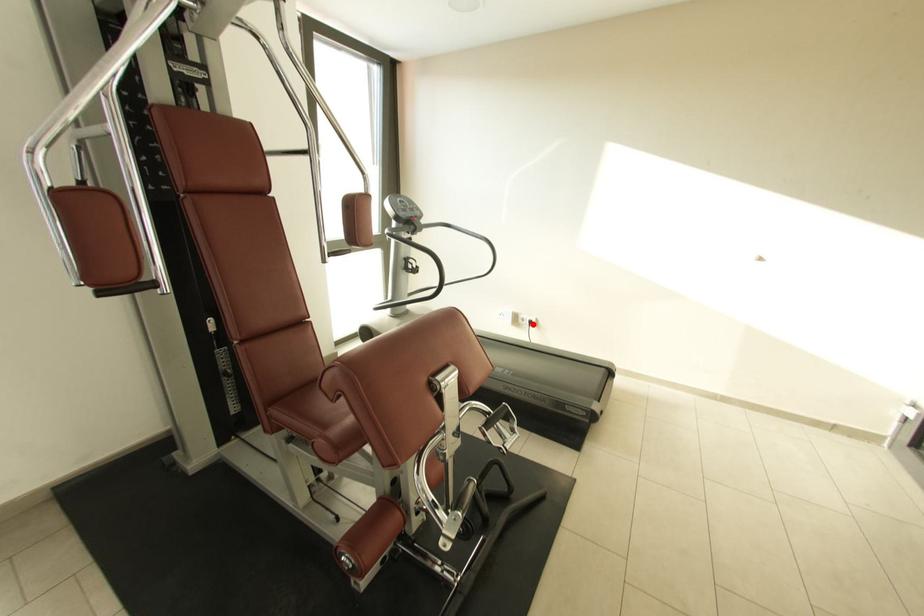
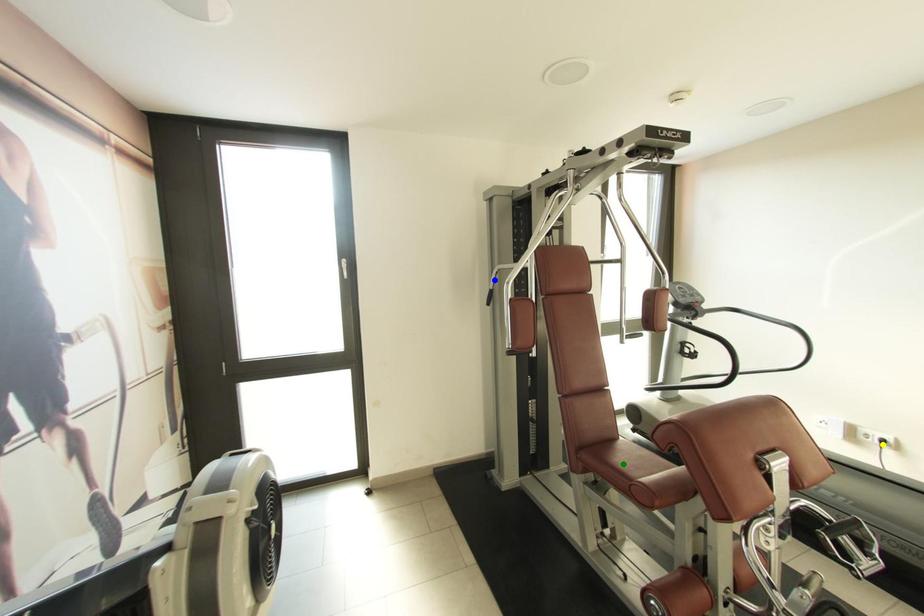
Question: I am providing you with two images of the same scene from different viewpoints. A red point is marked on the first image. You are given multiple points on the second image. Can you choose the point in image 2 that corresponds to the point in image 1?

Choices:
 (A) green point
 (B) blue point
 (C) yellow point

Answer: (C)